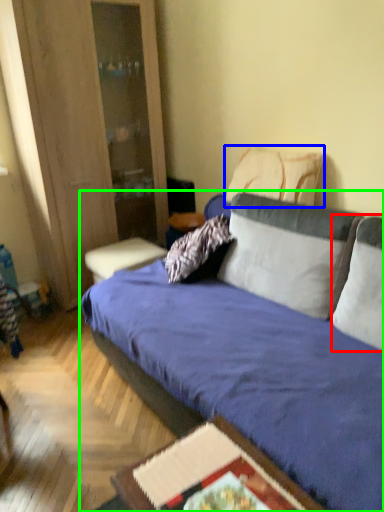
Question: Considering the real-world distances, which object is closest to pillow (highlighted by a red box)? pillow (highlighted by a blue box) or studio couch (highlighted by a green box).

Choices:
 (A) pillow
 (B) studio couch

Answer: (B)